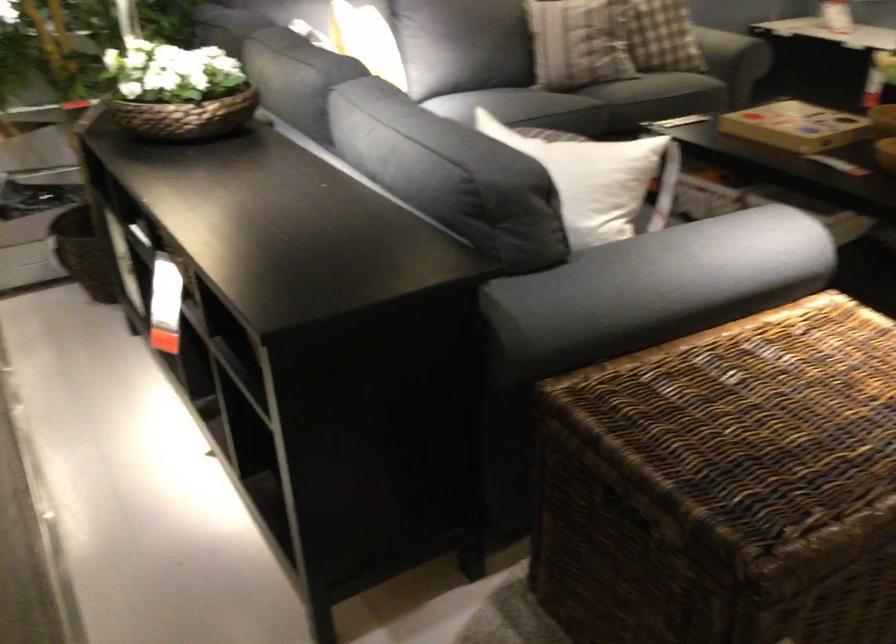
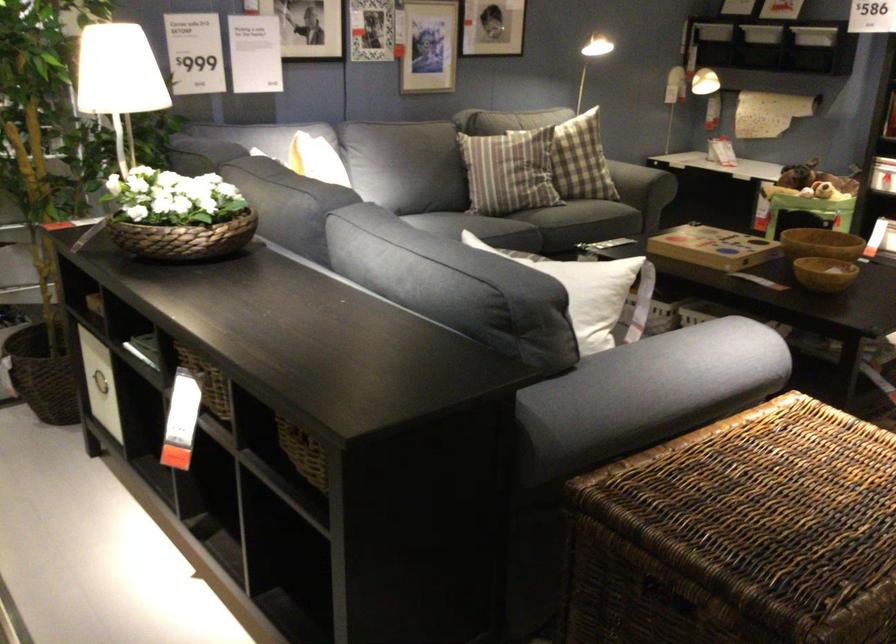
The point at (122, 259) is marked in the first image. Where is the corresponding point in the second image?

(99, 383)